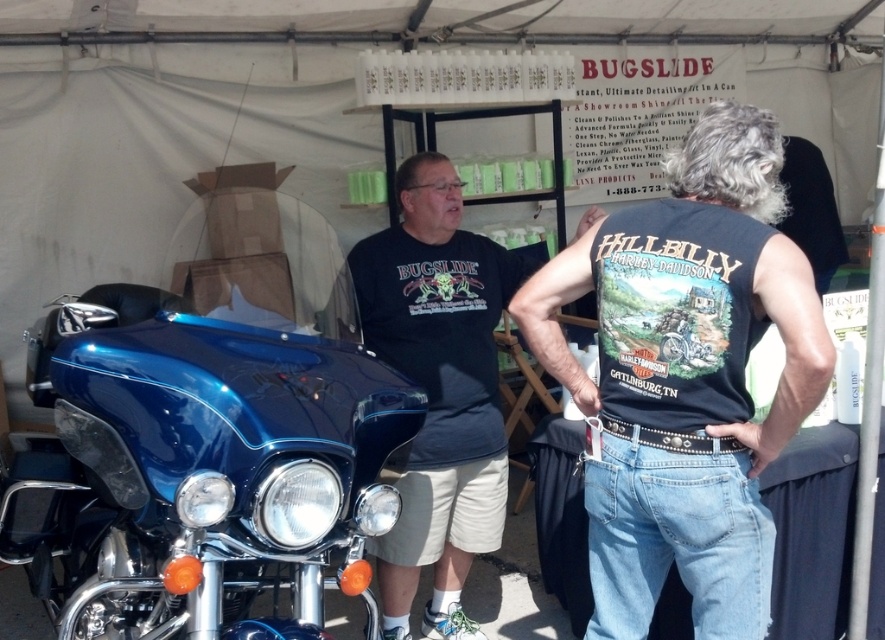
You are at an event and want to take a photo of the glossy blue motorcycle at left without any people in the frame. Since the denim jeans at center are blocking the view, where should you move to get an unobstructed shot?

The glossy blue motorcycle at left is positioned under denim jeans at center, so moving to the right side of the denim jeans at center would allow you to see the motorcycle without obstruction.

You are standing at the point with coordinates point (136, 502) and want to move to the point with coordinates point (721, 461). Given the scene described, will you be moving towards the motorcycle or away from it?

Since point (136, 502) is behind point (721, 461), moving from point (136, 502) to point (721, 461) means you are moving towards the motorcycle.